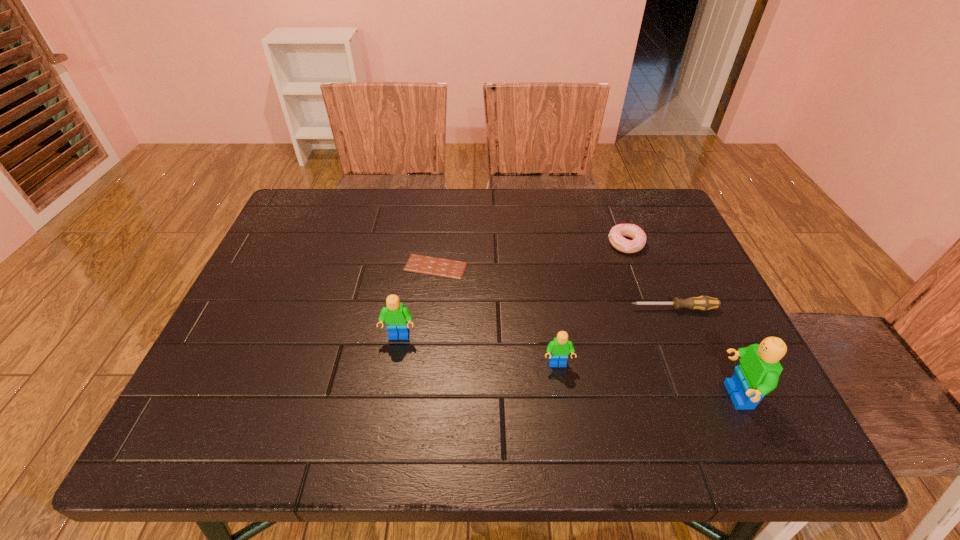
Locate an element on the screen. object that ranks as the fifth closest to the farthest Lego is located at coordinates (757, 375).

You are a GUI agent. You are given a task and a screenshot of the screen. Output one action in this format:
    pyautogui.click(x=<x>, y=<y>)
    Task: Click on the fourth closest object to the chocolate bar
    The height and width of the screenshot is (540, 960).
    Given the screenshot: What is the action you would take?
    pyautogui.click(x=704, y=303)

In order to click on Lego that stands as the closest to the doughnut in this screenshot , I will do `click(558, 349)`.

This screenshot has height=540, width=960. Find the location of `the second closest Lego to the doughnut`. the second closest Lego to the doughnut is located at coordinates (757, 375).

Where is `vacant area that satisfies the following two spatial constraints: 1. at the tip of the third farthest object; 2. on the face of the leftmost Lego`? vacant area that satisfies the following two spatial constraints: 1. at the tip of the third farthest object; 2. on the face of the leftmost Lego is located at coordinates (685, 337).

Where is `free space that satisfies the following two spatial constraints: 1. at the tip of the fourth nearest object; 2. on the face of the farthest Lego`? The height and width of the screenshot is (540, 960). free space that satisfies the following two spatial constraints: 1. at the tip of the fourth nearest object; 2. on the face of the farthest Lego is located at coordinates (685, 337).